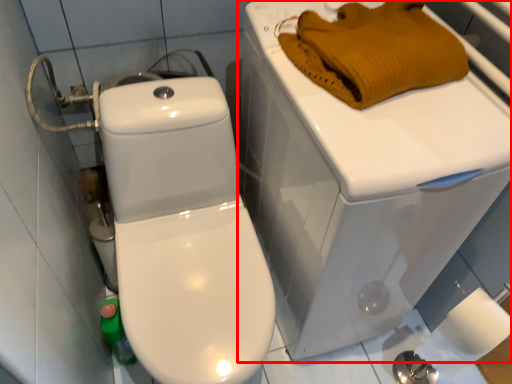
Question: Observing the image, what is the correct spatial positioning of porcelain (annotated by the red box) in reference to material?

Choices:
 (A) left
 (B) right

Answer: (A)